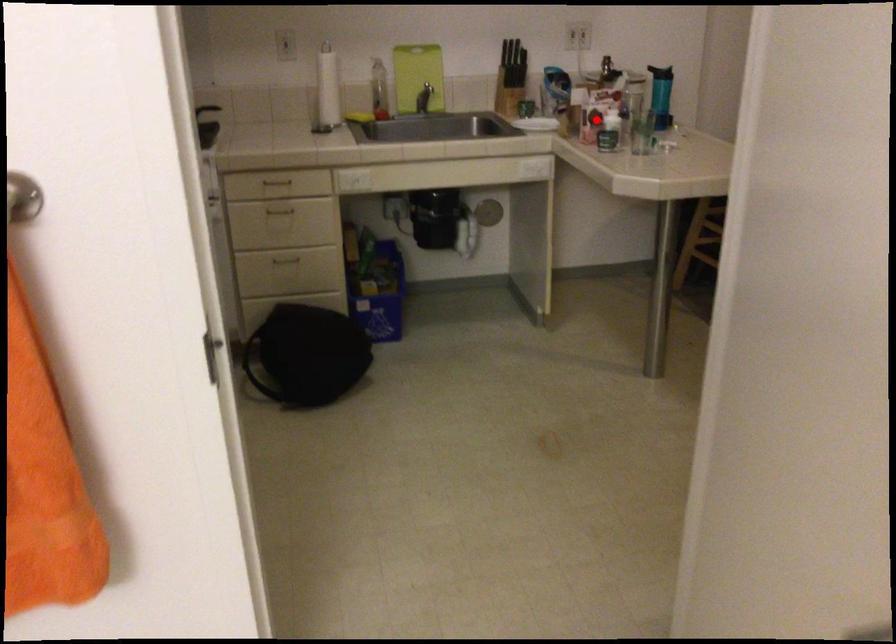
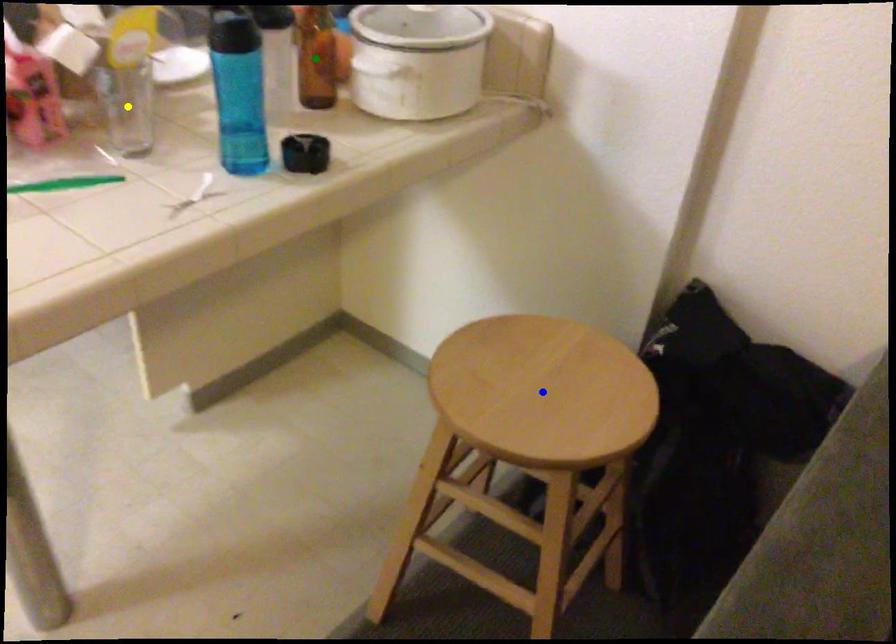
Question: I am providing you with two images of the same scene from different viewpoints. A red point is marked on the first image. You are given multiple points on the second image. Can you choose the point in image 2 that corresponds to the point in image 1?

Choices:
 (A) yellow point
 (B) blue point
 (C) green point

Answer: (A)